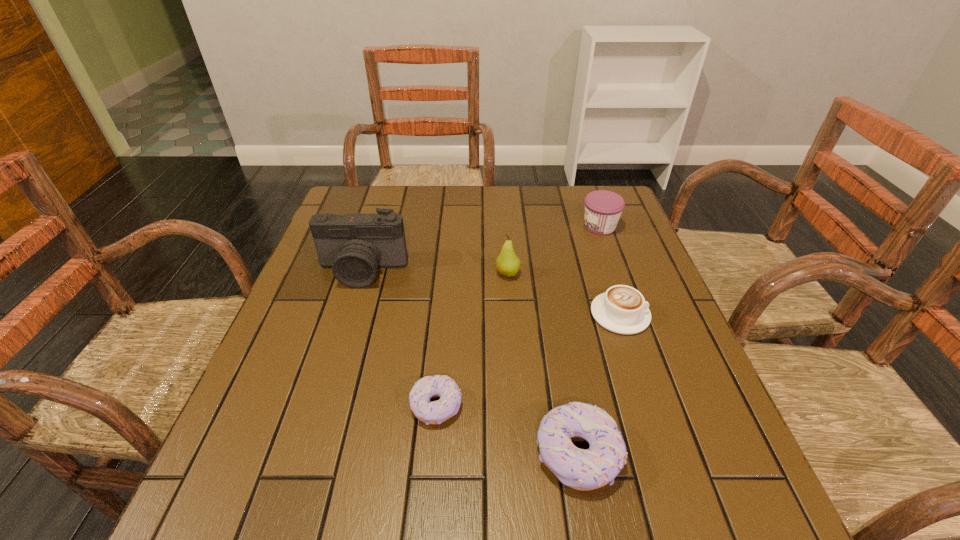
Identify the location of jam situated at the right edge. Image resolution: width=960 pixels, height=540 pixels. (603, 208).

Locate an element on the screen. This screenshot has width=960, height=540. cappuccino that is at the right edge is located at coordinates (622, 309).

At what (x,y) coordinates should I click in order to perform the action: click on object present at the far right corner. Please return your answer as a coordinate pair (x, y). Looking at the image, I should click on (603, 208).

Where is `vacant space at the far edge of the desktop`? Image resolution: width=960 pixels, height=540 pixels. vacant space at the far edge of the desktop is located at coordinates (552, 188).

You are a GUI agent. You are given a task and a screenshot of the screen. Output one action in this format:
    pyautogui.click(x=<x>, y=<y>)
    Task: Click on the free space at the left edge of the desktop
    The width and height of the screenshot is (960, 540).
    Given the screenshot: What is the action you would take?
    pyautogui.click(x=298, y=394)

Find the location of a particular element. vacant space at the right edge of the desktop is located at coordinates (644, 294).

Image resolution: width=960 pixels, height=540 pixels. In the image, there is a desktop. In order to click on free space at the far left corner in this screenshot , I will do `click(350, 207)`.

This screenshot has height=540, width=960. In order to click on vacant area at the near right corner in this screenshot , I will do `click(691, 454)`.

At what (x,y) coordinates should I click in order to perform the action: click on vacant area that lies between the leftmost object and the pear. Please return your answer as a coordinate pair (x, y). This screenshot has height=540, width=960. Looking at the image, I should click on (435, 272).

Where is `empty location between the camera and the second shortest object`? This screenshot has width=960, height=540. empty location between the camera and the second shortest object is located at coordinates (492, 293).